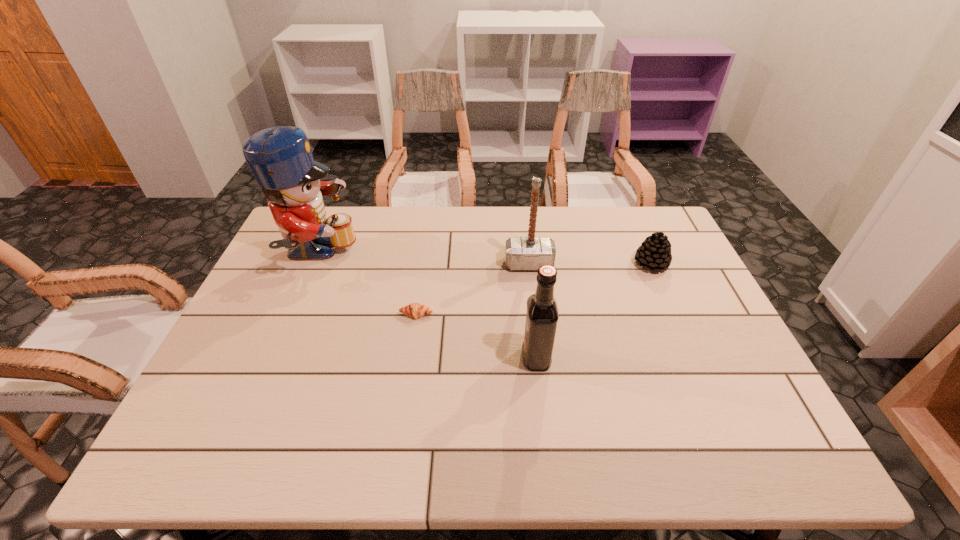
The image size is (960, 540). What are the coordinates of `free space located on the front-facing side of the liquor` in the screenshot? It's located at (493, 358).

I want to click on vacant point located on the front-facing side of the liquor, so click(367, 358).

Image resolution: width=960 pixels, height=540 pixels. Identify the location of blank area located on the front-facing side of the liquor. (448, 358).

At what (x,y) coordinates should I click in order to perform the action: click on free space located 0.290m at the narrow end of the rightmost object. Please return your answer as a coordinate pair (x, y). This screenshot has height=540, width=960. Looking at the image, I should click on [x=690, y=353].

At what (x,y) coordinates should I click in order to perform the action: click on vacant space located on the front-facing side of the shortest object. Please return your answer as a coordinate pair (x, y). Image resolution: width=960 pixels, height=540 pixels. Looking at the image, I should click on (408, 374).

You are a GUI agent. You are given a task and a screenshot of the screen. Output one action in this format:
    pyautogui.click(x=<x>, y=<y>)
    Task: Click on the object located in the far edge section of the desktop
    The image size is (960, 540).
    Given the screenshot: What is the action you would take?
    pyautogui.click(x=280, y=158)

Image resolution: width=960 pixels, height=540 pixels. I want to click on object that is at the left edge, so click(280, 158).

Where is `object present at the right edge`? The height and width of the screenshot is (540, 960). object present at the right edge is located at coordinates (654, 253).

Identify the location of object that is at the far left corner. (280, 158).

Locate an element on the screen. This screenshot has width=960, height=540. vacant space at the far edge of the desktop is located at coordinates (545, 217).